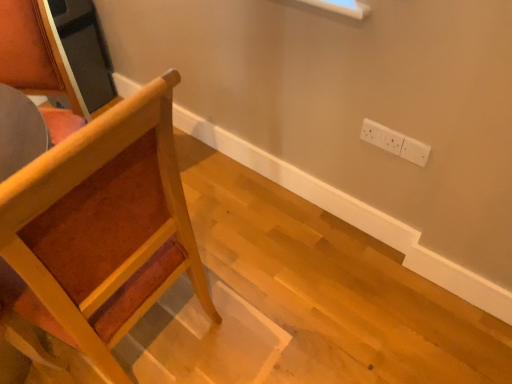
At what (x,y) coordinates should I click in order to perform the action: click on vacant space to the right of wooden chair at left. Please return your answer as a coordinate pair (x, y). The width and height of the screenshot is (512, 384). Looking at the image, I should click on (261, 302).